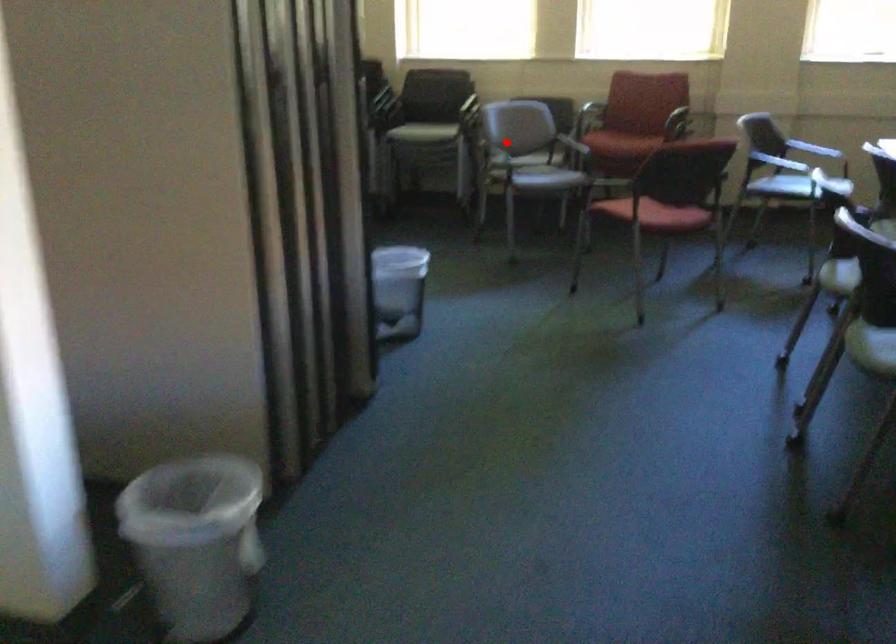
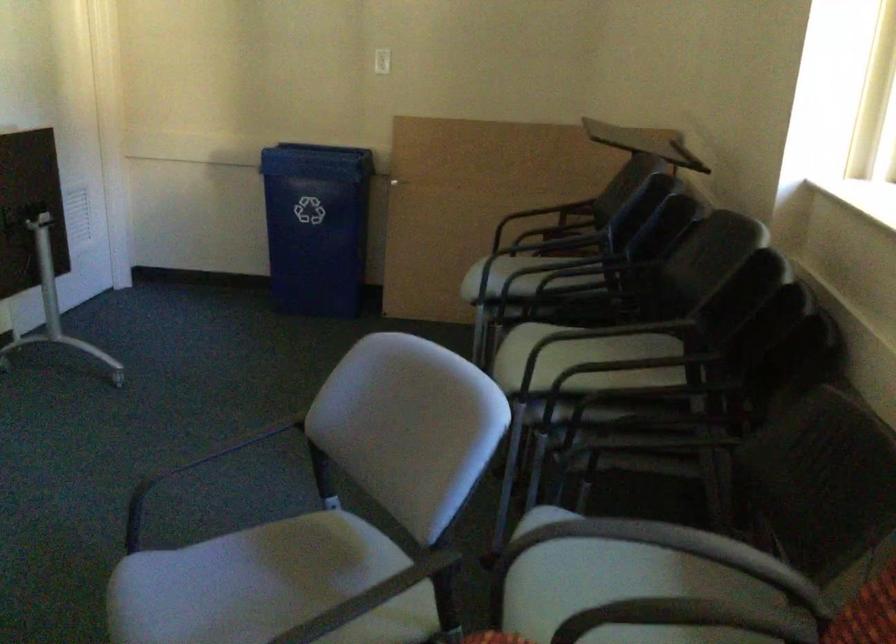
Locate, in the second image, the point that corresponds to the highlighted location in the first image.

(230, 446)